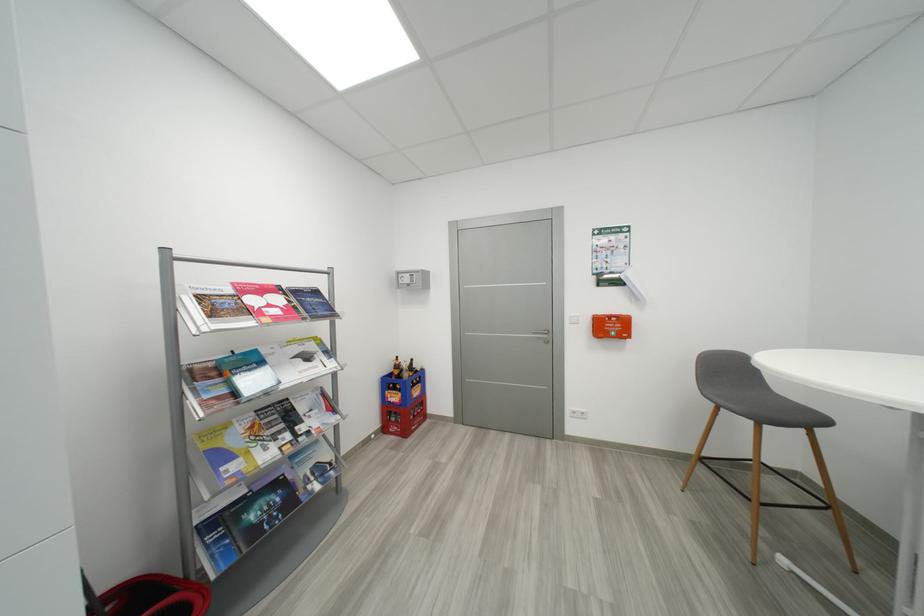
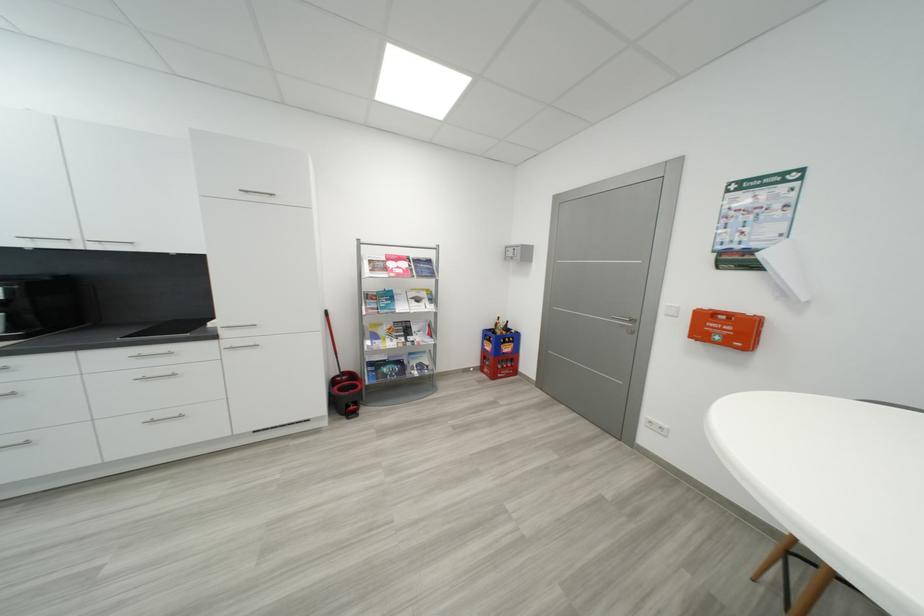
The point at (617, 330) is marked in the first image. Where is the corresponding point in the second image?

(733, 333)